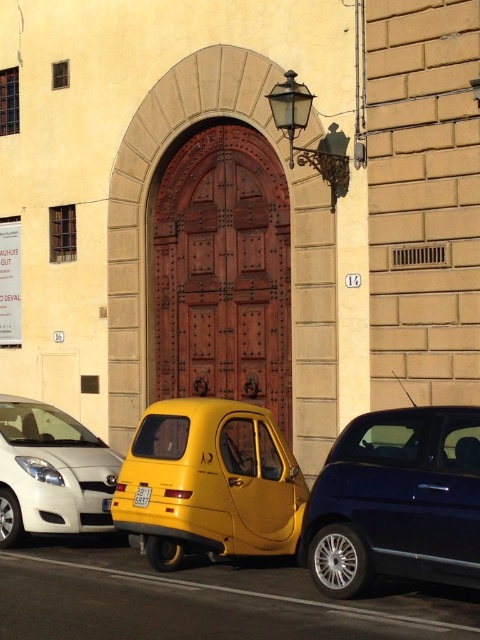
Is point (78, 531) positioned in front of point (104, 499)?

Yes, it is in front of point (104, 499).

Which is below, white glossy car at lower left or yellow matte license plate at center?

yellow matte license plate at center is below.

The height and width of the screenshot is (640, 480). In order to click on white glossy car at lower left in this screenshot , I will do `click(50, 472)`.

Is yellow plastic license plate at center below yellow matte license plate at center?

No.

Does point (147, 499) come closer to viewer compared to point (110, 502)?

Yes, point (147, 499) is in front of point (110, 502).

At what (x,y) coordinates should I click in order to perform the action: click on yellow plastic license plate at center. Please return your answer as a coordinate pair (x, y). This screenshot has width=480, height=640. Looking at the image, I should click on (142, 496).

The image size is (480, 640). What are the coordinates of `yellow plastic license plate at center` in the screenshot? It's located at (142, 496).

Looking at this image, can you confirm if shiny blue car at right is thinner than yellow matte license plate at center?

In fact, shiny blue car at right might be wider than yellow matte license plate at center.

Between point (429, 440) and point (109, 500), which one is positioned in front?

Point (429, 440)

Locate an element on the screen. Image resolution: width=480 pixels, height=640 pixels. shiny blue car at right is located at coordinates (396, 500).